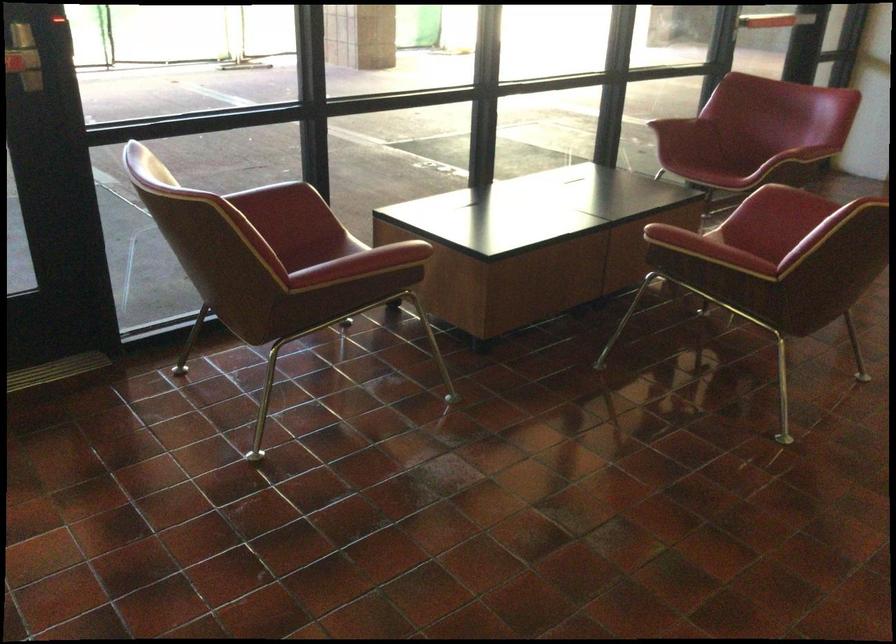
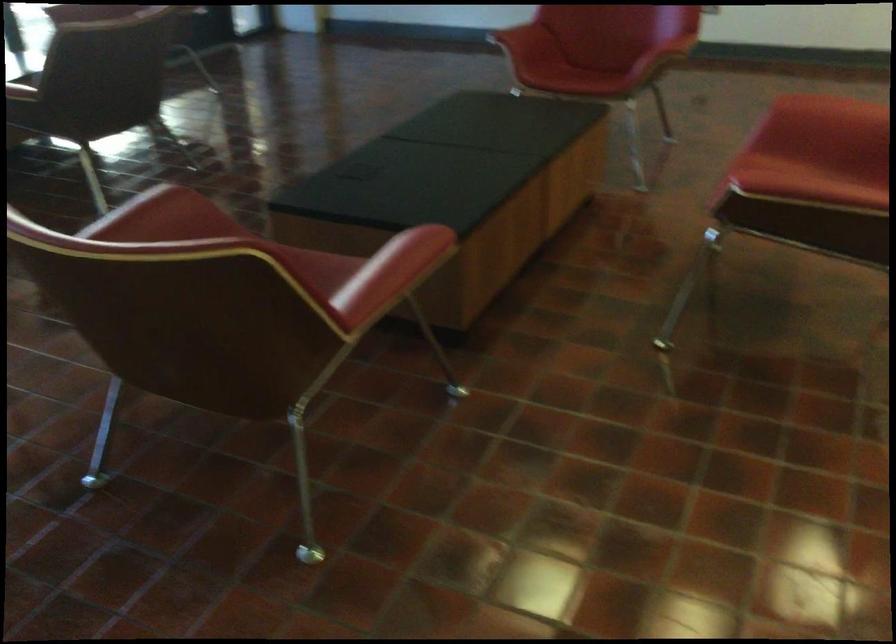
In a continuous first-person perspective shot, in which direction is the camera moving?

The movement direction of the cameraman is right, backward.